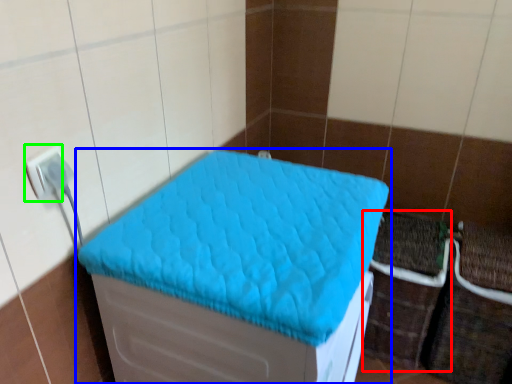
Question: Based on their relative distances, which object is nearer to crate (highlighted by a red box)? Choose from furniture (highlighted by a blue box) and electric outlet (highlighted by a green box).

Choices:
 (A) furniture
 (B) electric outlet

Answer: (A)